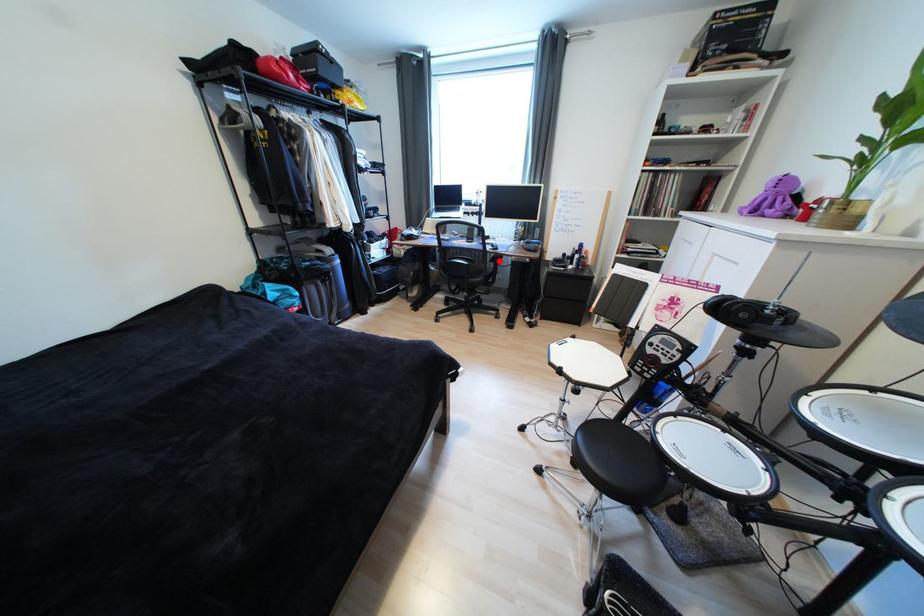
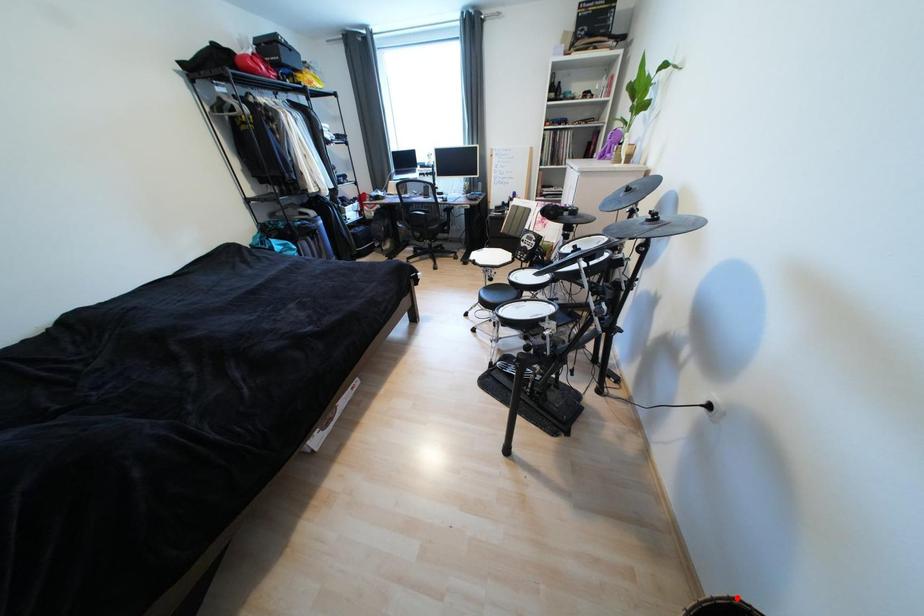
I am providing you with two images of the same scene from different viewpoints. A red point is marked on the first image and another point is marked on the second image. Does the point marked in image1 correspond to the same location as the one in image2?

No